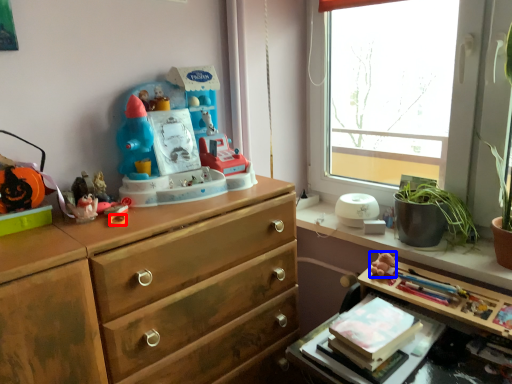
Question: Among these objects, which one is nearest to the camera, knob (highlighted by a red box) or miniature (highlighted by a blue box)?

Choices:
 (A) knob
 (B) miniature

Answer: (A)